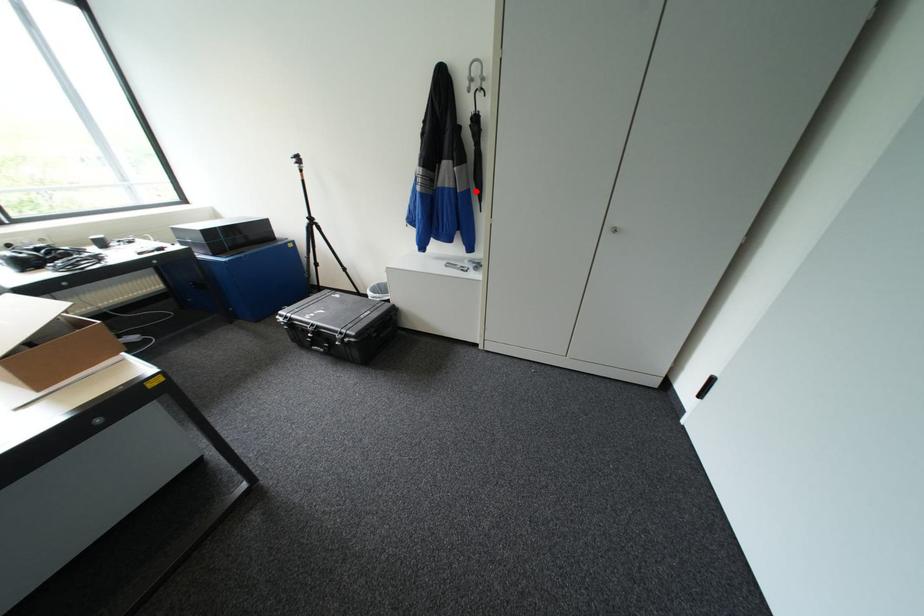
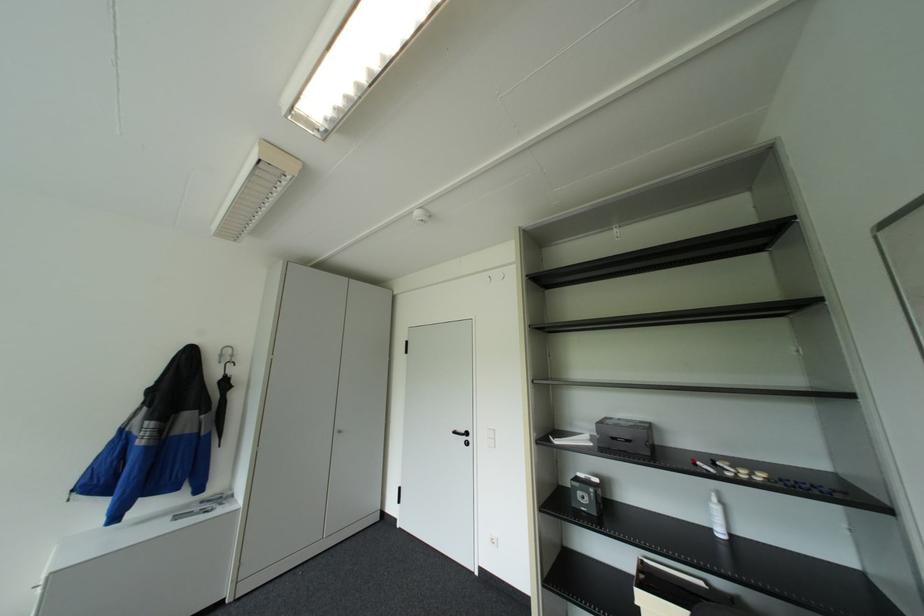
In the second image, find the point that corresponds to the highlighted location in the first image.

(217, 432)